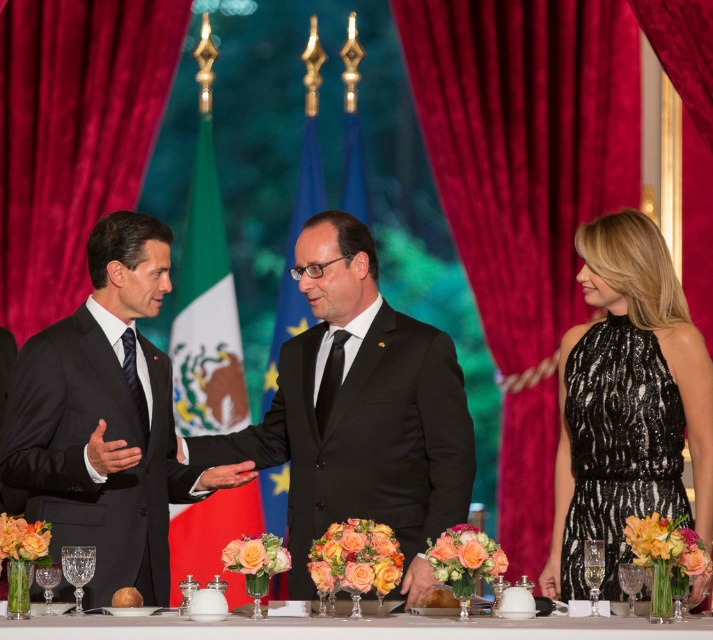
You are a photographer at a diplomatic event. You need to capture a photo that includes both the velvet red curtain at left and the black sequined dress at right. Given that your camera has a maximum focus range of 25 feet, will you be able to include both subjects in the same frame without moving your position?

The velvet red curtain at left and the black sequined dress at right are 26.27 feet apart from each other, which exceeds the camera maximum focus range of 25 feet. Therefore, you cannot include both subjects in the same frame without moving your position.

You are a photographer positioned at the back of the room, aiming to capture a closeup of both the point at (543, 228) and the point at (636, 440). Which point should you focus on first to ensure both are in sharp focus?

You should focus on point (543, 228) first because it is closer to the camera than point (636, 440). By focusing on the closer point, the farther point will also be within the depth of field, ensuring both are in focus.